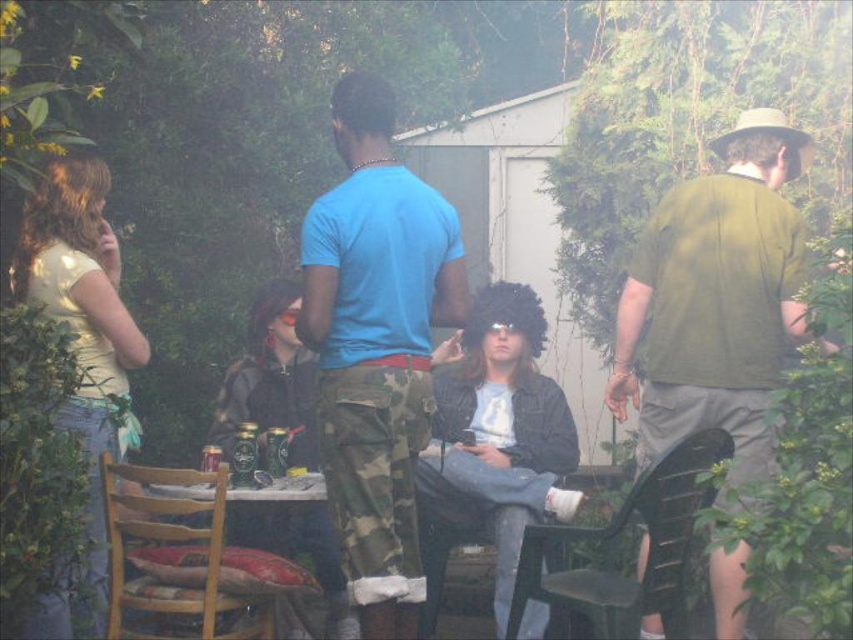
Can you confirm if blue t-shirt at center is positioned above wooden chair at lower left?

Correct, blue t-shirt at center is located above wooden chair at lower left.

Who is shorter, blue t-shirt at center or wooden chair at lower left?

wooden chair at lower left

Is point (396, 250) in front of point (173, 588)?

That is True.

Locate an element on the screen. The height and width of the screenshot is (640, 853). blue t-shirt at center is located at coordinates pyautogui.click(x=376, y=346).

At what (x,y) coordinates should I click in order to perform the action: click on green matte shirt at right. Please return your answer as a coordinate pair (x, y). The image size is (853, 640). Looking at the image, I should click on (717, 298).

Does green matte shirt at right have a lesser width compared to black plastic chair at lower right?

No, green matte shirt at right is not thinner than black plastic chair at lower right.

Does point (801, 273) lie behind point (532, 544)?

Yes.

Locate an element on the screen. green matte shirt at right is located at coordinates (717, 298).

Between point (439, 209) and point (705, 304), which one is positioned behind?

Point (705, 304)

Does point (364, 196) lie in front of point (689, 330)?

Yes, it is.

Between point (392, 92) and point (717, 344), which one is positioned in front?

Point (392, 92) is in front.

Find the location of a particular element. This screenshot has width=853, height=640. blue t-shirt at center is located at coordinates (x=376, y=346).